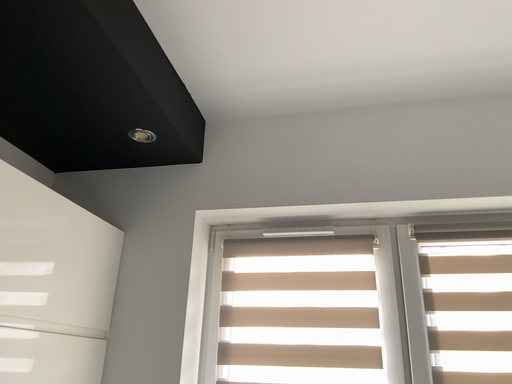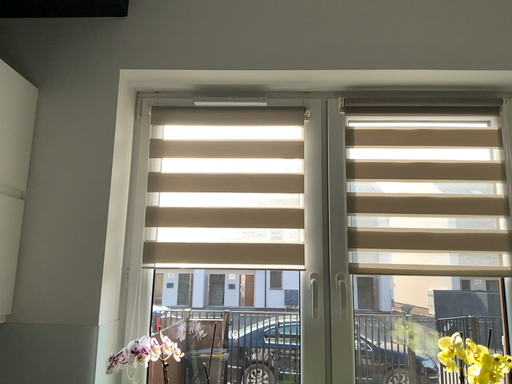
Question: How did the camera likely rotate when shooting the video?

Choices:
 (A) rotated left
 (B) rotated right

Answer: (B)